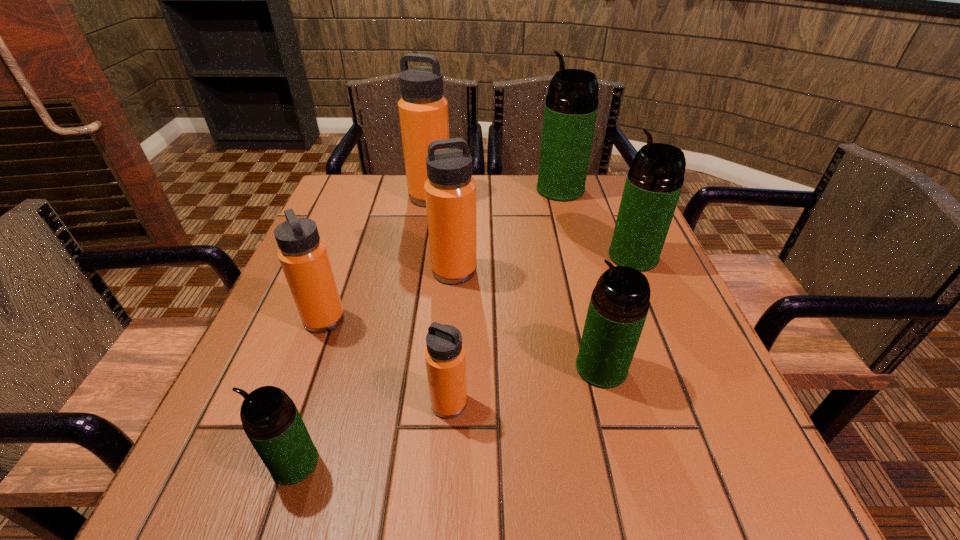
Where is `the farthest orange thermos bottle`? The height and width of the screenshot is (540, 960). the farthest orange thermos bottle is located at coordinates (423, 110).

The width and height of the screenshot is (960, 540). I want to click on the farthest green thermos bottle, so click(571, 106).

Identify the location of the rightmost green thermos bottle. [x=655, y=179].

Identify the location of the second farthest green thermos bottle. This screenshot has height=540, width=960. (655, 179).

I want to click on the second biggest orange thermos bottle, so click(450, 191).

Locate an element on the screen. the third farthest orange thermos bottle is located at coordinates (303, 256).

The height and width of the screenshot is (540, 960). I want to click on the leftmost orange thermos bottle, so click(x=303, y=256).

The width and height of the screenshot is (960, 540). I want to click on the third biggest green thermos bottle, so click(619, 304).

You are a GUI agent. You are given a task and a screenshot of the screen. Output one action in this format:
    pyautogui.click(x=<x>, y=<y>)
    Task: Click on the leftmost green thermos bottle
    Image resolution: width=960 pixels, height=540 pixels.
    Given the screenshot: What is the action you would take?
    pyautogui.click(x=270, y=419)

You are a GUI agent. You are given a task and a screenshot of the screen. Output one action in this format:
    pyautogui.click(x=<x>, y=<y>)
    Task: Click on the nearest green thermos bottle
    This screenshot has width=960, height=540.
    Given the screenshot: What is the action you would take?
    pyautogui.click(x=270, y=419)